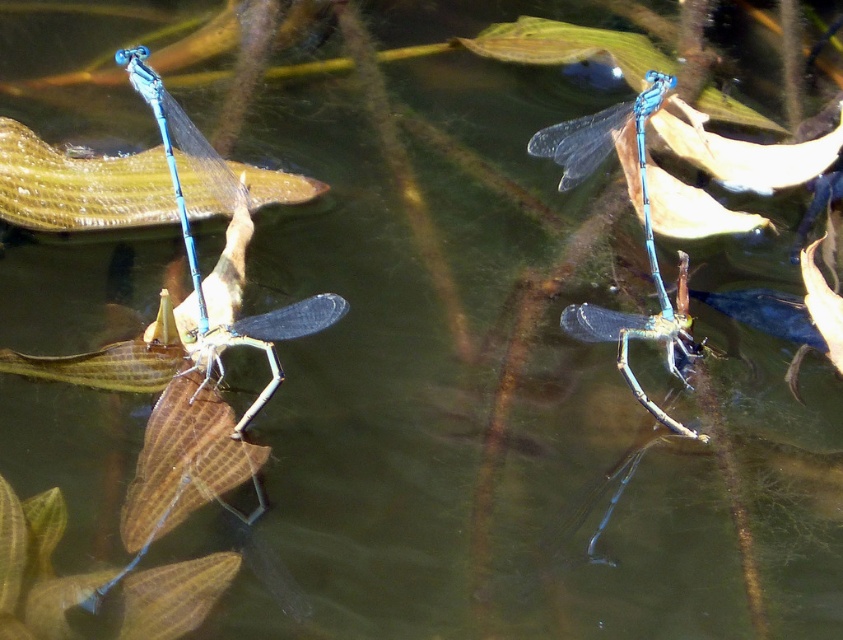
Question: From the image, what is the correct spatial relationship of blue translucent wings at center in relation to transparent blue dragonfly at center?

Choices:
 (A) below
 (B) above

Answer: (B)

Question: Which of the following is the closest to the observer?

Choices:
 (A) blue translucent wings at center
 (B) transparent blue dragonfly at center

Answer: (A)

Question: Does blue translucent wings at center appear on the right side of transparent blue dragonfly at center?

Choices:
 (A) no
 (B) yes

Answer: (A)

Question: Which point is farther from the camera taking this photo?

Choices:
 (A) (260, 344)
 (B) (686, 352)

Answer: (B)

Question: Is blue translucent wings at center further to the viewer compared to transparent blue dragonfly at center?

Choices:
 (A) no
 (B) yes

Answer: (A)